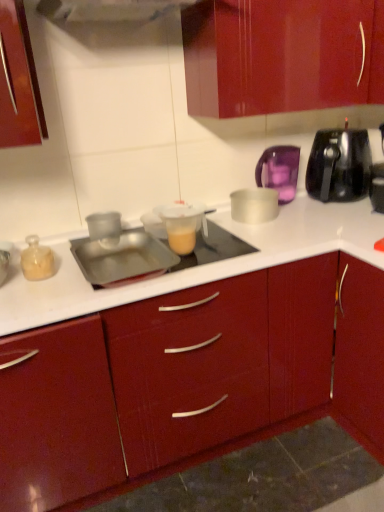
Question: Is purple translucent kettle at upper right, the 4th kitchen appliance when ordered from left to right, next to metallic silver tray at center, marked as the 1th appliance in a left-to-right arrangement, and touching it?

Choices:
 (A) no
 (B) yes

Answer: (A)

Question: Can you confirm if purple translucent kettle at upper right, the second kitchen appliance in the right-to-left sequence, is taller than metallic silver tray at center, arranged as the 2th appliance when viewed from the right?

Choices:
 (A) yes
 (B) no

Answer: (A)

Question: From a real-world perspective, is purple translucent kettle at upper right, the second kitchen appliance in the right-to-left sequence, under metallic silver tray at center, marked as the 1th appliance in a left-to-right arrangement?

Choices:
 (A) no
 (B) yes

Answer: (A)

Question: Considering the relative sizes of purple translucent kettle at upper right, the second kitchen appliance in the right-to-left sequence, and metallic silver tray at center, marked as the 1th appliance in a left-to-right arrangement, in the image provided, is purple translucent kettle at upper right, the second kitchen appliance in the right-to-left sequence, smaller than metallic silver tray at center, marked as the 1th appliance in a left-to-right arrangement,?

Choices:
 (A) no
 (B) yes

Answer: (A)

Question: From a real-world perspective, is purple translucent kettle at upper right, the second kitchen appliance in the right-to-left sequence, on top of metallic silver tray at center, marked as the 1th appliance in a left-to-right arrangement?

Choices:
 (A) yes
 (B) no

Answer: (A)

Question: From the image's perspective, is purple translucent kettle at upper right, the 4th kitchen appliance when ordered from left to right, below metallic silver tray at center, arranged as the 2th appliance when viewed from the right?

Choices:
 (A) yes
 (B) no

Answer: (B)

Question: From a real-world perspective, is translucent glass jar at left, the 5th kitchen appliance positioned from the right, on translucent plastic measuring cup at center, placed as the first appliance when sorted from right to left?

Choices:
 (A) no
 (B) yes

Answer: (B)

Question: Is translucent glass jar at left, which is the 1th kitchen appliance from left to right, further to the viewer compared to translucent plastic measuring cup at center, placed as the first appliance when sorted from right to left?

Choices:
 (A) no
 (B) yes

Answer: (A)

Question: Is translucent glass jar at left, the 5th kitchen appliance positioned from the right, looking in the opposite direction of translucent plastic measuring cup at center, which appears as the 2th appliance when viewed from the left?

Choices:
 (A) no
 (B) yes

Answer: (A)

Question: Is translucent glass jar at left, which is the 1th kitchen appliance from left to right, to the left of translucent plastic measuring cup at center, which appears as the 2th appliance when viewed from the left, from the viewer's perspective?

Choices:
 (A) no
 (B) yes

Answer: (B)

Question: Is translucent glass jar at left, the 5th kitchen appliance positioned from the right, to the right of translucent plastic measuring cup at center, placed as the first appliance when sorted from right to left, from the viewer's perspective?

Choices:
 (A) yes
 (B) no

Answer: (B)

Question: Considering the relative sizes of translucent glass jar at left, which is the 1th kitchen appliance from left to right, and translucent plastic measuring cup at center, placed as the first appliance when sorted from right to left, in the image provided, is translucent glass jar at left, which is the 1th kitchen appliance from left to right, shorter than translucent plastic measuring cup at center, placed as the first appliance when sorted from right to left,?

Choices:
 (A) no
 (B) yes

Answer: (B)

Question: Does translucent glass jar at left, which is the 1th kitchen appliance from left to right, have a smaller size compared to purple translucent kettle at upper right, the second kitchen appliance in the right-to-left sequence?

Choices:
 (A) yes
 (B) no

Answer: (A)